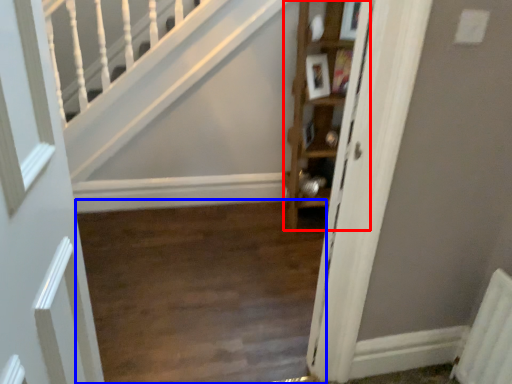
Question: Which object appears farthest to the camera in this image, cabinet (highlighted by a red box) or corridor (highlighted by a blue box)?

Choices:
 (A) cabinet
 (B) corridor

Answer: (A)